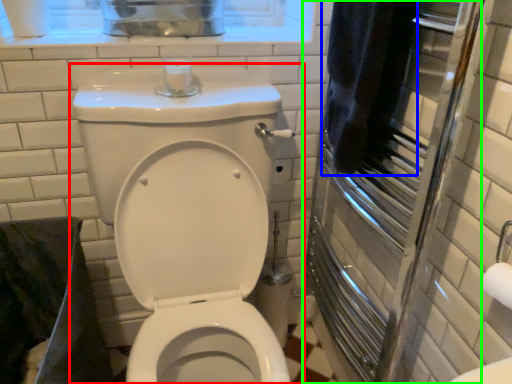
Question: Which object is the farthest from toilet (highlighted by a red box)? Choose among these: bath towel (highlighted by a blue box) or screen door (highlighted by a green box).

Choices:
 (A) bath towel
 (B) screen door

Answer: (A)